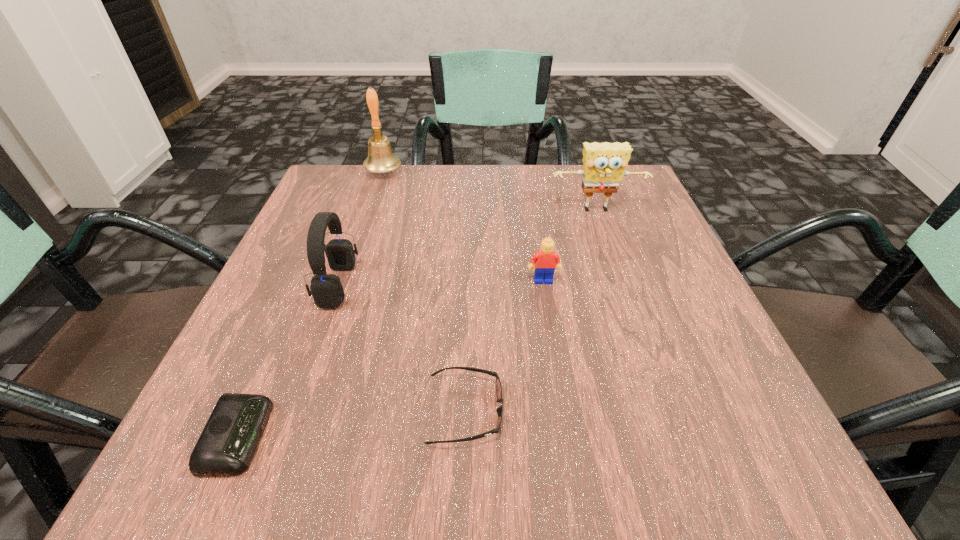
Find the location of a particular element. This screenshot has height=540, width=960. vacant space that is in between the second object from right to left and the bell is located at coordinates (464, 226).

The image size is (960, 540). What are the coordinates of `free space that is in between the alarm clock and the sunglasses` in the screenshot? It's located at click(352, 423).

Point out which object is positioned as the fourth nearest to the sponge. Please provide its 2D coordinates. Your answer should be formatted as a tuple, i.e. [(x, y)], where the tuple contains the x and y coordinates of a point satisfying the conditions above.

[(498, 387)]

Locate an element on the screen. object that stands as the fifth closest to the headset is located at coordinates (604, 164).

The image size is (960, 540). I want to click on free point that satisfies the following two spatial constraints: 1. on the face of the rightmost object; 2. on the display of the alarm clock, so click(x=676, y=436).

Where is `free location that satisfies the following two spatial constraints: 1. on the face of the second object from right to left; 2. on the display of the alarm clock`? Image resolution: width=960 pixels, height=540 pixels. free location that satisfies the following two spatial constraints: 1. on the face of the second object from right to left; 2. on the display of the alarm clock is located at coordinates (567, 436).

Where is `vacant region that satisfies the following two spatial constraints: 1. on the face of the sponge; 2. on the front-facing side of the third object from right to left`? This screenshot has width=960, height=540. vacant region that satisfies the following two spatial constraints: 1. on the face of the sponge; 2. on the front-facing side of the third object from right to left is located at coordinates (666, 411).

Where is `free region that satisfies the following two spatial constraints: 1. on the face of the sponge; 2. on the front-facing side of the sunglasses`? Image resolution: width=960 pixels, height=540 pixels. free region that satisfies the following two spatial constraints: 1. on the face of the sponge; 2. on the front-facing side of the sunglasses is located at coordinates (666, 411).

Image resolution: width=960 pixels, height=540 pixels. In order to click on vacant region that satisfies the following two spatial constraints: 1. on the face of the Lego; 2. on the headband of the headset in this screenshot , I will do `click(544, 285)`.

Find the location of a particular element. The height and width of the screenshot is (540, 960). vacant space that satisfies the following two spatial constraints: 1. on the face of the rightmost object; 2. on the front-facing side of the sunglasses is located at coordinates [666, 411].